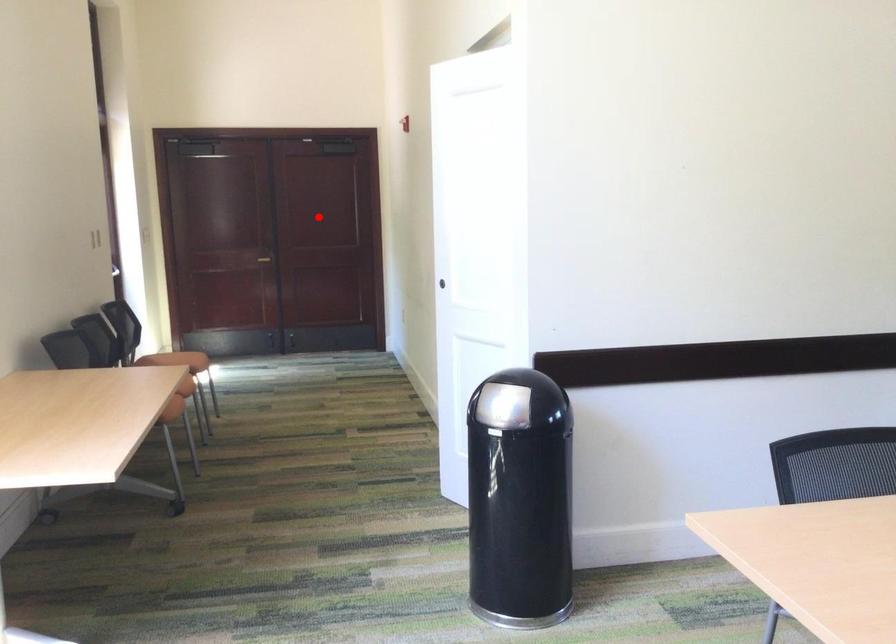
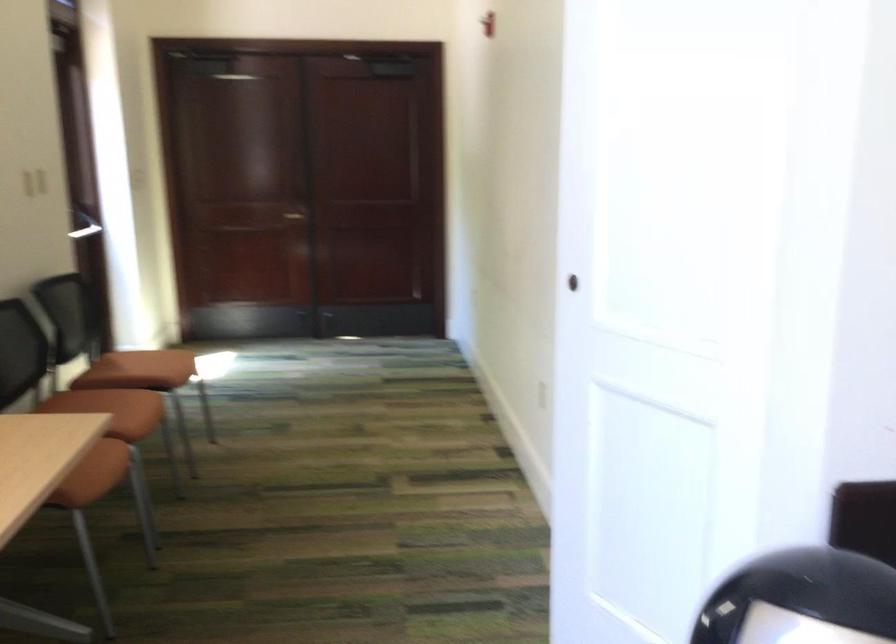
Where in the second image is the point corresponding to the highlighted location from the first image?

(364, 182)